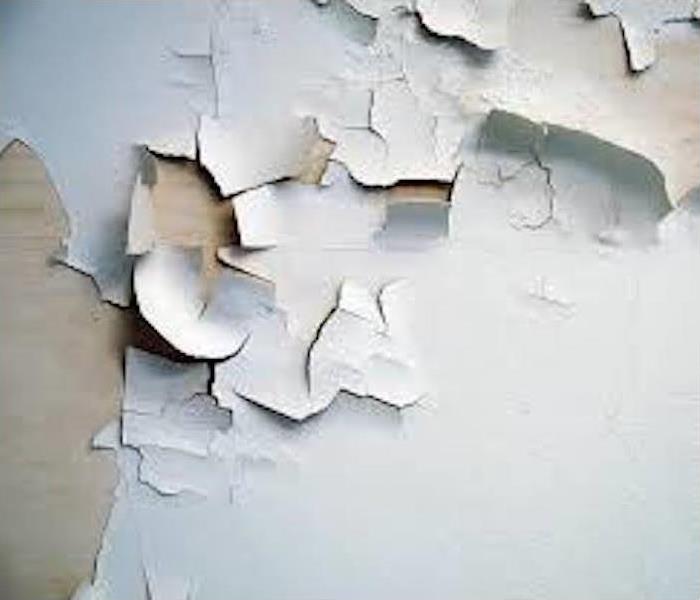
At what (x,y) coordinates should I click in order to perform the action: click on light brown wall. Please return your answer as a coordinate pair (x, y). Looking at the image, I should click on (46, 450).